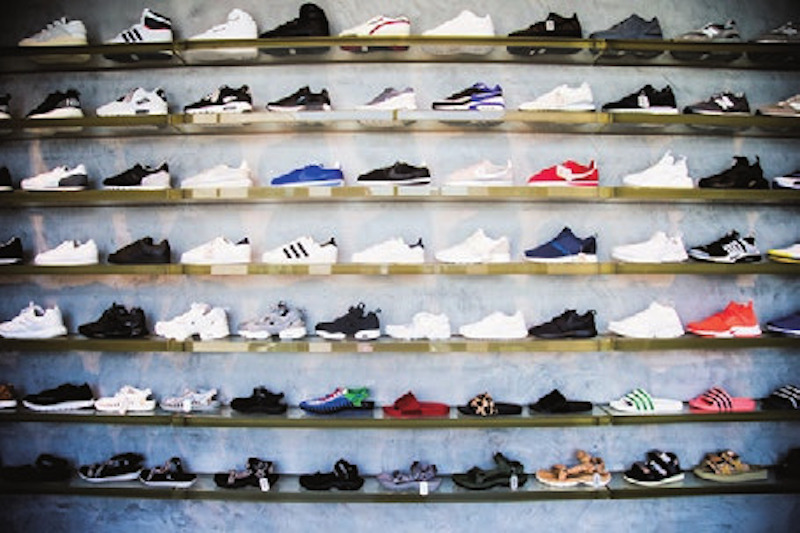
The height and width of the screenshot is (533, 800). What are the coordinates of `shelves` in the screenshot? It's located at (374, 489), (376, 417), (390, 341), (414, 265), (440, 201), (438, 126), (420, 46).